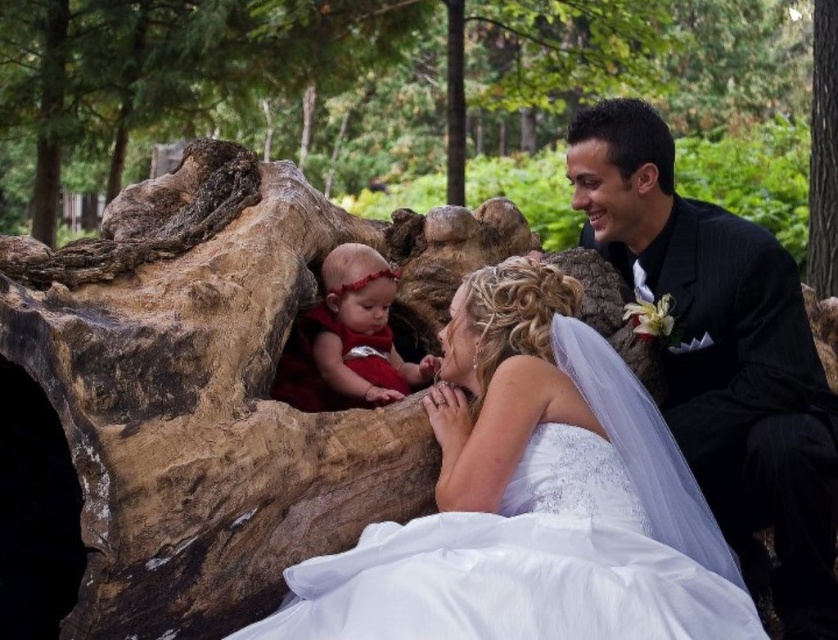
Question: Which point is closer to the camera?

Choices:
 (A) (825, 100)
 (B) (397, 13)

Answer: (A)

Question: Does white satin dress at center have a larger size compared to brown rough tree trunk at right?

Choices:
 (A) yes
 (B) no

Answer: (B)

Question: Which point appears farthest from the camera in this image?

Choices:
 (A) (834, 216)
 (B) (370, 317)
 (C) (247, 118)

Answer: (C)

Question: Can you confirm if brown rough log at center is smaller than white lace dress at center?

Choices:
 (A) yes
 (B) no

Answer: (B)

Question: Can you confirm if black pinstripe suit at right is smaller than matte red dress at center?

Choices:
 (A) yes
 (B) no

Answer: (A)

Question: Which point is farther to the camera?

Choices:
 (A) (138, 74)
 (B) (286, 346)
 (C) (807, 266)

Answer: (A)